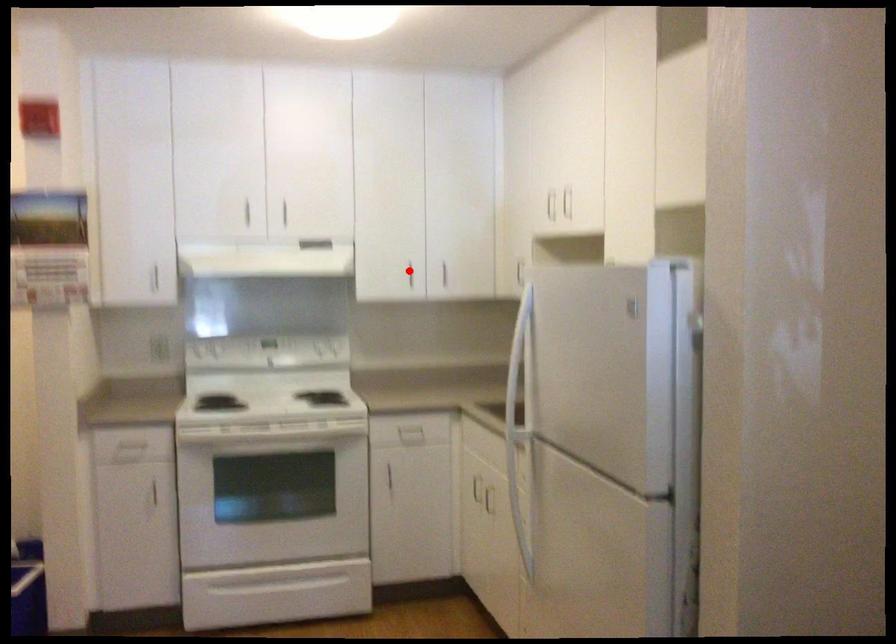
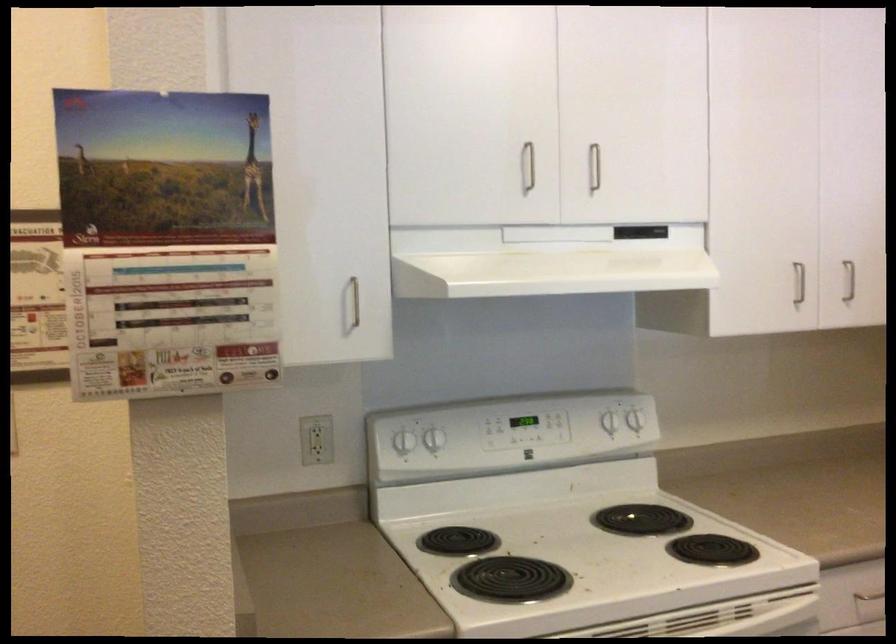
Question: I am providing you with two images of the same scene from different viewpoints. Image1 has a red point marked. In image2, the corresponding 3D location appears at what relative position? Reply with the corresponding letter.

Choices:
 (A) Closer
 (B) Farther

Answer: (A)